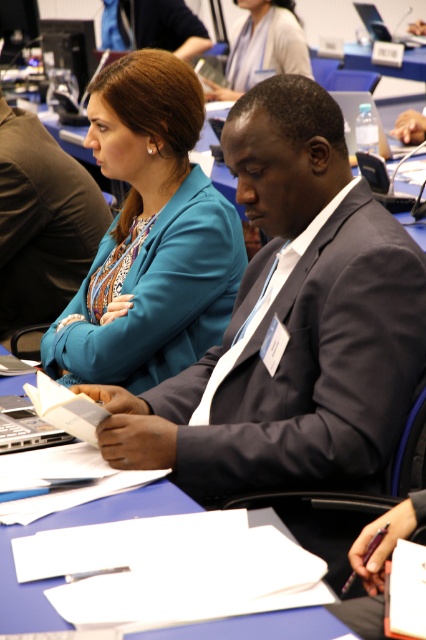
You are an event organizer trying to arrange seating for a group photo. You have two attendees wearing the teal fabric jacket at upper center and the matte black suit at center. Which attendee requires a larger chair to accommodate their clothing?

The attendee wearing the teal fabric jacket at upper center requires a larger chair because the teal fabric jacket at upper center is larger in size than the matte black suit at center.